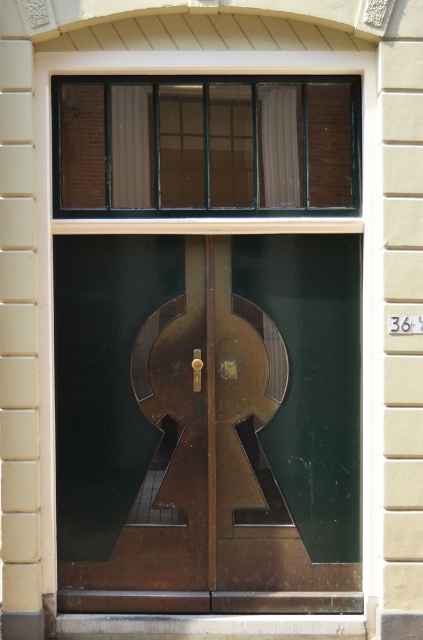
You are standing in front of the building and want to locate the exact spot where the door handle is. According to the image, where is the point at coordinate point [208,422] located?

The point at coordinate point [208,422] is located on the bronze metallic door at center, which is where the door handle is situated.

Consider the image. You are standing in front of the building and notice the bronze metallic door at center and the matte glass window at upper center. Which object is positioned to the right side of the other?

The bronze metallic door at center is to the right of the matte glass window at upper center.